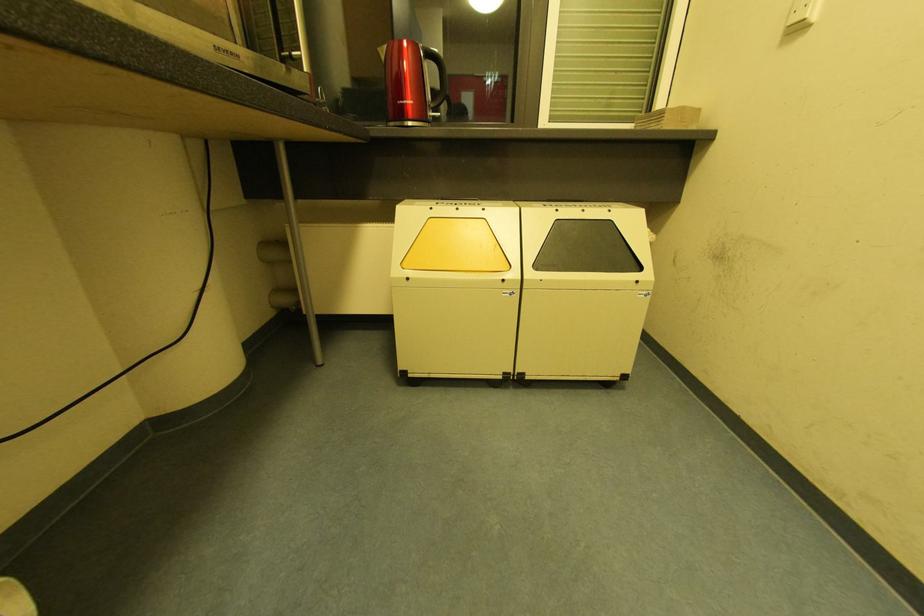
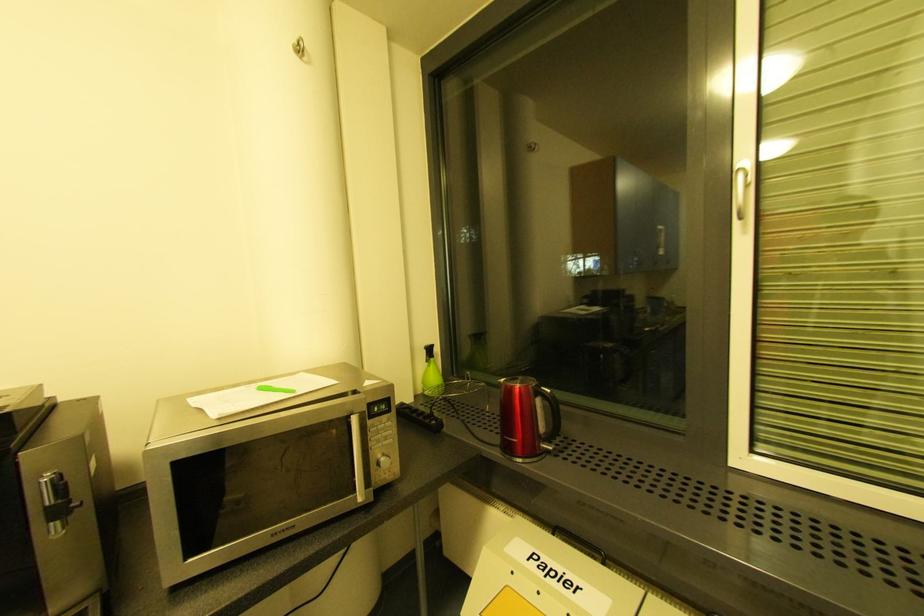
Question: The camera is either moving clockwise (left) or counter-clockwise (right) around the object. The first image is from the beginning of the video and the second image is from the end. Is the camera moving left or right when shooting the video?

Choices:
 (A) Left
 (B) Right

Answer: (B)